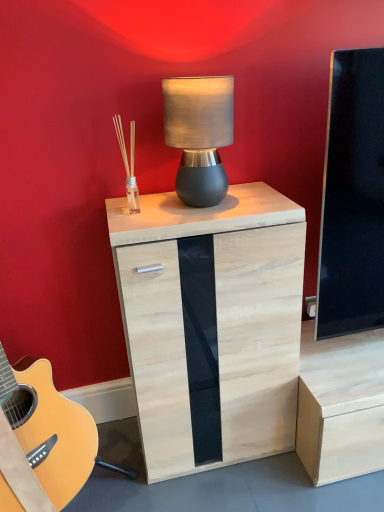
You are a GUI agent. You are given a task and a screenshot of the screen. Output one action in this format:
    pyautogui.click(x=<x>, y=<y>)
    Task: Click on the vacant point to the right of matte gray lamp at center
    This screenshot has height=512, width=384.
    Given the screenshot: What is the action you would take?
    pyautogui.click(x=261, y=196)